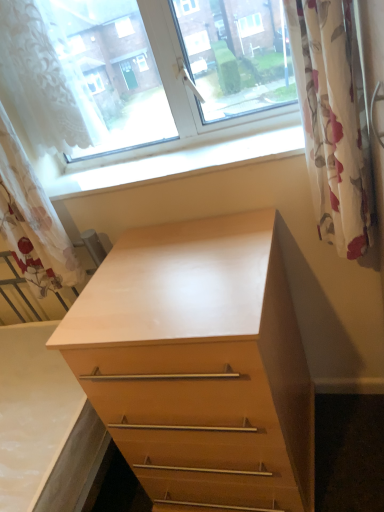
I want to click on white smooth window sill at upper center, so click(180, 162).

Can you confirm if light wood chest of drawers at center is taller than white lace curtain at upper left?

Yes, light wood chest of drawers at center is taller than white lace curtain at upper left.

From the image's perspective, which is above, light wood chest of drawers at center or white lace curtain at upper left?

white lace curtain at upper left appears higher in the image.

How different are the orientations of light wood chest of drawers at center and white lace curtain at upper left in degrees?

light wood chest of drawers at center and white lace curtain at upper left are facing 1.33 degrees away from each other.

Considering the relative sizes of light wood chest of drawers at center and white lace curtain at upper left in the image provided, is light wood chest of drawers at center thinner than white lace curtain at upper left?

In fact, light wood chest of drawers at center might be wider than white lace curtain at upper left.

From a real-world perspective, between floral fabric curtain at right, positioned as the second curtain in left-to-right order, and white smooth window sill at upper center, who is vertically lower?

In real-world perspective, white smooth window sill at upper center is lower.

From the image's perspective, is floral fabric curtain at right, which is the first curtain in right-to-left order, above or below white smooth window sill at upper center?

Clearly, from the image's perspective, floral fabric curtain at right, which is the first curtain in right-to-left order, is below white smooth window sill at upper center.

Considering the positions of points (349, 132) and (210, 145), is point (349, 132) farther from camera compared to point (210, 145)?

No, (349, 132) is in front of (210, 145).

Which object is positioned more to the right, floral fabric curtain at right, positioned as the second curtain in left-to-right order, or white smooth window sill at upper center?

From the viewer's perspective, floral fabric curtain at right, positioned as the second curtain in left-to-right order, appears more on the right side.

Could you tell me if light wood chest of drawers at center is turned towards floral fabric curtain at right, which is the first curtain in right-to-left order?

No.

Looking at the image, does light wood chest of drawers at center seem bigger or smaller compared to floral fabric curtain at right, which is the first curtain in right-to-left order?

Clearly, light wood chest of drawers at center is larger in size than floral fabric curtain at right, which is the first curtain in right-to-left order.

Is light wood chest of drawers at center in front of or behind floral fabric curtain at right, positioned as the second curtain in left-to-right order, in the image?

Clearly, light wood chest of drawers at center is behind floral fabric curtain at right, positioned as the second curtain in left-to-right order.

Image resolution: width=384 pixels, height=512 pixels. In order to click on the 2nd curtain above when counting from the light wood chest of drawers at center (from the image's perspective) in this screenshot , I will do `click(333, 121)`.

What's the angular difference between floral fabric curtain at right, which is the first curtain in right-to-left order, and light wood chest of drawers at center's facing directions?

floral fabric curtain at right, which is the first curtain in right-to-left order, and light wood chest of drawers at center are facing 1.59 degrees away from each other.

Which of these two, floral fabric curtain at right, positioned as the second curtain in left-to-right order, or light wood chest of drawers at center, stands shorter?

With less height is floral fabric curtain at right, positioned as the second curtain in left-to-right order.

Is floral fabric curtain at right, which is the first curtain in right-to-left order, directly adjacent to light wood chest of drawers at center?

floral fabric curtain at right, which is the first curtain in right-to-left order, and light wood chest of drawers at center are not in contact.

Is floral fabric curtain at right, which is the first curtain in right-to-left order, not within light wood chest of drawers at center?

Indeed, floral fabric curtain at right, which is the first curtain in right-to-left order, is completely outside light wood chest of drawers at center.

Considering the relative sizes of white smooth window sill at upper center and light wood chest of drawers at center in the image provided, is white smooth window sill at upper center wider than light wood chest of drawers at center?

No, white smooth window sill at upper center is not wider than light wood chest of drawers at center.

In the image, is white smooth window sill at upper center positioned in front of or behind light wood chest of drawers at center?

In the image, white smooth window sill at upper center appears behind light wood chest of drawers at center.

Considering the sizes of white smooth window sill at upper center and light wood chest of drawers at center in the image, is white smooth window sill at upper center taller or shorter than light wood chest of drawers at center?

In the image, white smooth window sill at upper center appears to be shorter than light wood chest of drawers at center.

Locate an element on the screen. The width and height of the screenshot is (384, 512). shower curtain that appears above the white smooth window sill at upper center (from a real-world perspective) is located at coordinates (38, 81).

Is white smooth window sill at upper center situated inside white lace curtain at upper left or outside?

white smooth window sill at upper center exists outside the volume of white lace curtain at upper left.

Which of these two, white smooth window sill at upper center or white lace curtain at upper left, is wider?

With larger width is white smooth window sill at upper center.

From the image's perspective, would you say white smooth window sill at upper center is positioned over white lace curtain at upper left?

Actually, white smooth window sill at upper center appears below white lace curtain at upper left in the image.

From the picture: From a real-world perspective, is white lace curtain at left, which is the second curtain from right to left, positioned above or below floral fabric curtain at right, positioned as the second curtain in left-to-right order?

In terms of real-world spatial position, white lace curtain at left, which is the second curtain from right to left, is above floral fabric curtain at right, positioned as the second curtain in left-to-right order.

Does white lace curtain at left, which is the second curtain from right to left, have a larger size compared to floral fabric curtain at right, which is the first curtain in right-to-left order?

Yes, white lace curtain at left, which is the second curtain from right to left, is bigger than floral fabric curtain at right, which is the first curtain in right-to-left order.

From the image's perspective, which one is positioned higher, white lace curtain at left, the 1th curtain in the left-to-right sequence, or floral fabric curtain at right, which is the first curtain in right-to-left order?

floral fabric curtain at right, which is the first curtain in right-to-left order, appears higher in the image.

Can you tell me how much white lace curtain at left, which is the second curtain from right to left, and floral fabric curtain at right, positioned as the second curtain in left-to-right order, differ in facing direction?

The angle between the facing direction of white lace curtain at left, which is the second curtain from right to left, and the facing direction of floral fabric curtain at right, positioned as the second curtain in left-to-right order, is 0.00132 degrees.

Find the location of a particular element. The width and height of the screenshot is (384, 512). chest of drawers on the right side of white lace curtain at upper left is located at coordinates (199, 365).

This screenshot has height=512, width=384. In order to click on curtain that is the 2nd one when counting forward from the white smooth window sill at upper center in this screenshot , I will do `click(333, 121)`.

Considering their positions, is white lace curtain at upper left positioned closer to floral fabric curtain at right, positioned as the second curtain in left-to-right order, than white lace curtain at left, the 1th curtain in the left-to-right sequence?

white lace curtain at upper left is positioned closer to the anchor floral fabric curtain at right, positioned as the second curtain in left-to-right order.

Considering their positions, is white smooth window sill at upper center positioned further to light wood chest of drawers at center than white lace curtain at left, the 1th curtain in the left-to-right sequence?

The object further to light wood chest of drawers at center is white lace curtain at left, the 1th curtain in the left-to-right sequence.

Estimate the real-world distances between objects in this image. Which object is closer to floral fabric curtain at right, positioned as the second curtain in left-to-right order, white smooth window sill at upper center or white lace curtain at left, the 1th curtain in the left-to-right sequence?

The object closer to floral fabric curtain at right, positioned as the second curtain in left-to-right order, is white smooth window sill at upper center.

Based on the photo, considering their positions, is white lace curtain at upper left positioned closer to light wood chest of drawers at center than floral fabric curtain at right, which is the first curtain in right-to-left order?

floral fabric curtain at right, which is the first curtain in right-to-left order, is closer to light wood chest of drawers at center.

Based on their spatial positions, is white lace curtain at upper left or light wood chest of drawers at center closer to white smooth window sill at upper center?

Among the two, white lace curtain at upper left is located nearer to white smooth window sill at upper center.

Based on the photo, from the image, which object appears to be farther from floral fabric curtain at right, which is the first curtain in right-to-left order, white lace curtain at upper left or light wood chest of drawers at center?

white lace curtain at upper left is further to floral fabric curtain at right, which is the first curtain in right-to-left order.

From the image, which object appears to be farther from light wood chest of drawers at center, floral fabric curtain at right, which is the first curtain in right-to-left order, or white lace curtain at left, which is the second curtain from right to left?

white lace curtain at left, which is the second curtain from right to left, is further to light wood chest of drawers at center.

Which object lies further to the anchor point white lace curtain at left, which is the second curtain from right to left, light wood chest of drawers at center or white lace curtain at upper left?

light wood chest of drawers at center lies further to white lace curtain at left, which is the second curtain from right to left, than the other object.

Locate an element on the screen. Image resolution: width=384 pixels, height=512 pixels. window sill between white lace curtain at upper left and floral fabric curtain at right, which is the first curtain in right-to-left order, from left to right is located at coordinates (180, 162).

The image size is (384, 512). Find the location of `chest of drawers between white lace curtain at left, which is the second curtain from right to left, and floral fabric curtain at right, which is the first curtain in right-to-left order`. chest of drawers between white lace curtain at left, which is the second curtain from right to left, and floral fabric curtain at right, which is the first curtain in right-to-left order is located at coordinates (199, 365).

This screenshot has height=512, width=384. In order to click on window sill between white lace curtain at left, the 1th curtain in the left-to-right sequence, and floral fabric curtain at right, which is the first curtain in right-to-left order in this screenshot , I will do `click(180, 162)`.

At what (x,y) coordinates should I click in order to perform the action: click on shower curtain situated between white lace curtain at left, the 1th curtain in the left-to-right sequence, and white smooth window sill at upper center from left to right. Please return your answer as a coordinate pair (x, y). This screenshot has width=384, height=512. Looking at the image, I should click on (38, 81).